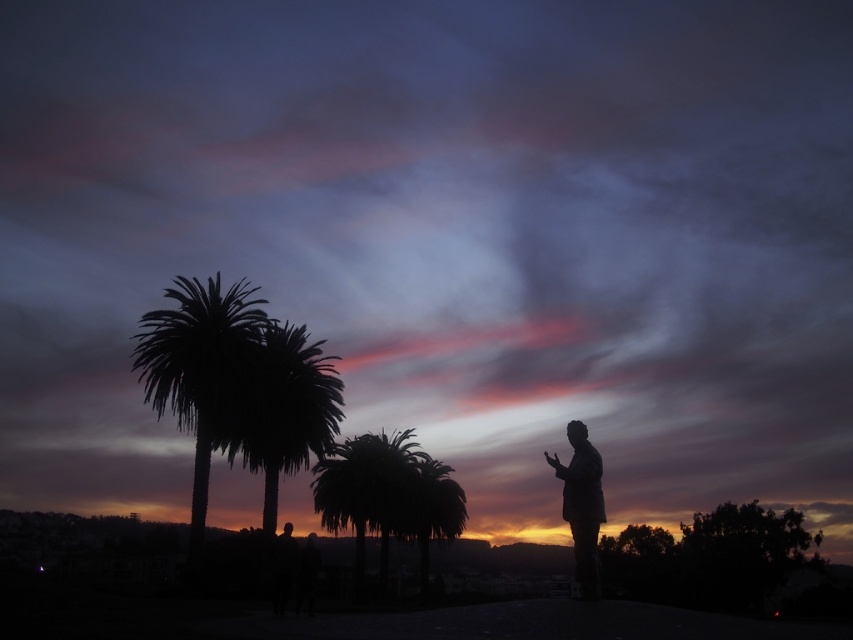
Based on the photo, who is more forward, (183, 321) or (277, 496)?

Point (183, 321)

Can you confirm if silhouette palm trees at left is positioned above silhouette palm tree at center?

Correct, silhouette palm trees at left is located above silhouette palm tree at center.

Is point (225, 292) closer to viewer compared to point (285, 372)?

Yes, it is.

I want to click on silhouette palm trees at left, so click(200, 368).

Which of these two, silhouette palm trees at left or silhouette statue at right, stands shorter?

silhouette statue at right is shorter.

Does silhouette palm trees at left come in front of silhouette statue at right?

No, it is behind silhouette statue at right.

Between point (173, 332) and point (581, 484), which one is positioned behind?

Point (173, 332)

Locate an element on the screen. silhouette palm trees at left is located at coordinates (200, 368).

Measure the distance from silhouette palm tree at center to silhouette statue at right.

silhouette palm tree at center is 35.53 meters away from silhouette statue at right.

Is point (294, 472) positioned after point (567, 502)?

Yes, point (294, 472) is behind point (567, 502).

Who is more distant from viewer, (341, 403) or (590, 502)?

Positioned behind is point (341, 403).

I want to click on silhouette palm tree at center, so click(x=283, y=410).